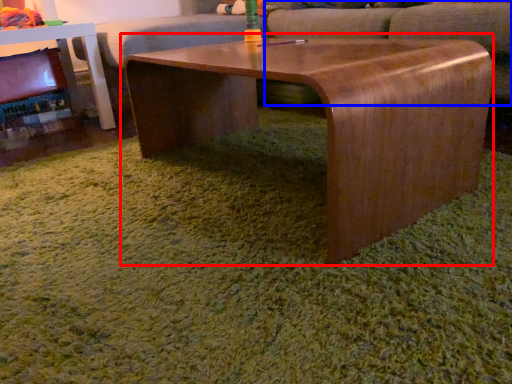
Question: Which object appears closest to the camera in this image, coffee table (highlighted by a red box) or swivel chair (highlighted by a blue box)?

Choices:
 (A) coffee table
 (B) swivel chair

Answer: (A)